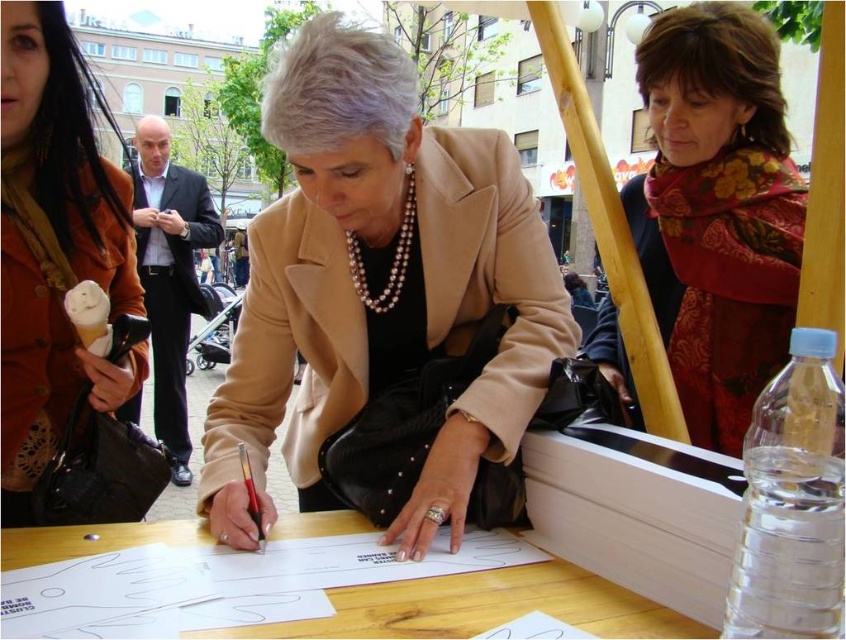
Which of these two, wooden table at center or metallic red pen at center, stands shorter?

wooden table at center

Who is positioned more to the left, wooden table at center or metallic red pen at center?

Positioned to the left is metallic red pen at center.

Is point (305, 529) positioned after point (250, 516)?

Yes, point (305, 529) is farther from viewer.

Locate an element on the screen. This screenshot has width=846, height=640. wooden table at center is located at coordinates (484, 608).

Which is more to the left, floral scarf at upper right or wooden table at center?

Positioned to the left is wooden table at center.

Which is behind, point (709, 186) or point (660, 625)?

The point (709, 186) is behind.

The height and width of the screenshot is (640, 846). What are the coordinates of `floral scarf at upper right` in the screenshot? It's located at (717, 211).

Who is higher up, brown leather purse at left or pearl necklace at center?

brown leather purse at left is higher up.

Does brown leather purse at left have a larger size compared to pearl necklace at center?

No.

Is point (125, 240) farther from viewer compared to point (404, 198)?

Yes, it is behind point (404, 198).

Find the location of a particular element. brown leather purse at left is located at coordinates (53, 248).